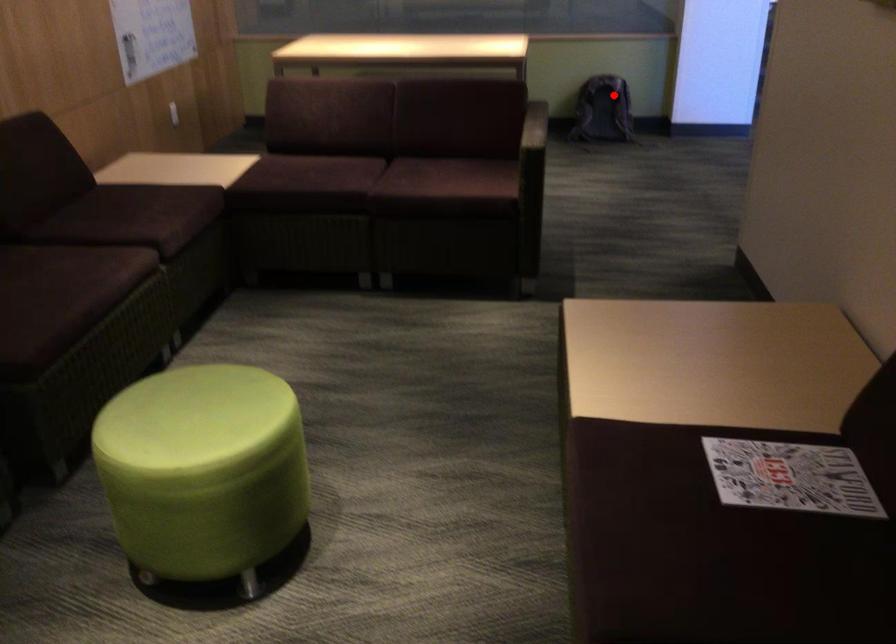
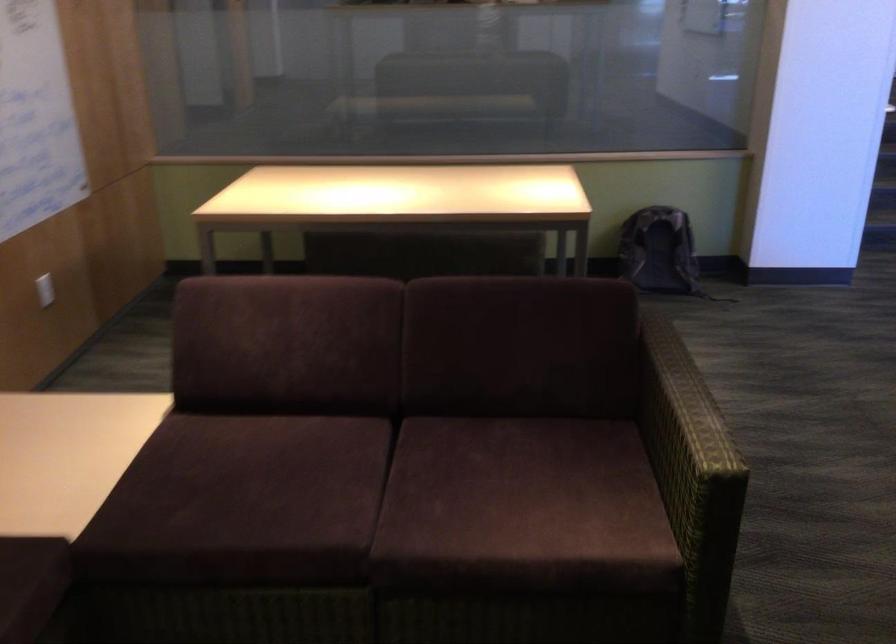
In the second image, find the point that corresponds to the highlighted location in the first image.

(660, 252)